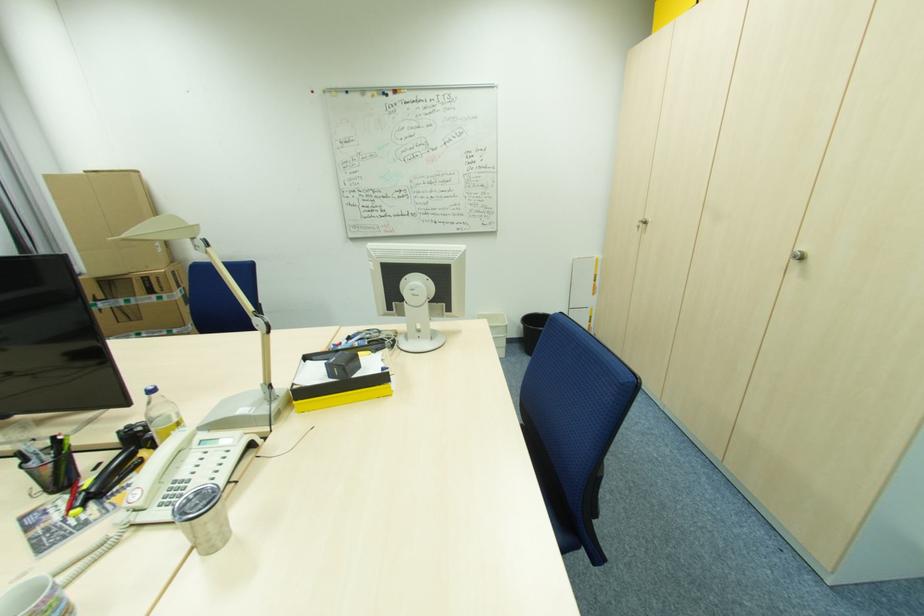
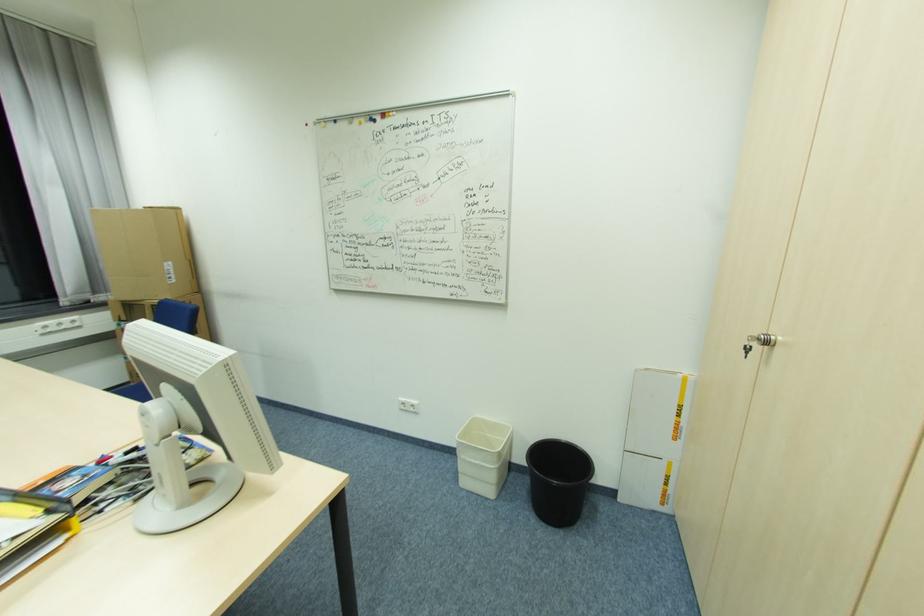
Locate, in the second image, the point that corresponds to point (649, 223) in the first image.

(772, 344)